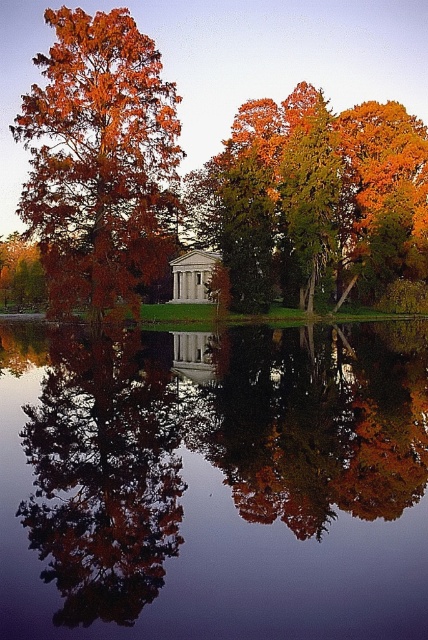
Question: Does orange foliage tree at upper left have a greater width compared to autumn leaves at center?

Choices:
 (A) no
 (B) yes

Answer: (B)

Question: Which point is closer to the camera?

Choices:
 (A) (380, 349)
 (B) (39, 237)

Answer: (A)

Question: Based on their relative distances, which object is nearer to the autumn leaves at center?

Choices:
 (A) orange-brown foliage at left
 (B) orange foliage tree at upper left

Answer: (A)

Question: Is the position of autumn leaves at center more distant than that of orange-brown foliage at left?

Choices:
 (A) yes
 (B) no

Answer: (B)

Question: Can you confirm if autumn leaves at center is positioned to the left of golden-green foliage at center?

Choices:
 (A) yes
 (B) no

Answer: (A)

Question: Among these objects, which one is nearest to the camera?

Choices:
 (A) orange-brown foliage at left
 (B) orange foliage tree at upper left

Answer: (A)